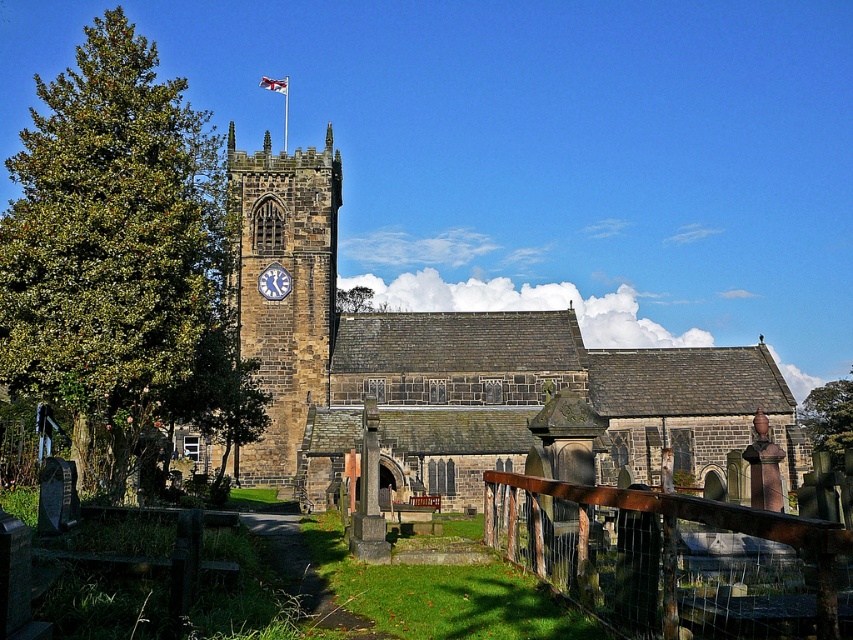
You are a photographer planning to capture the brown stone church at center and the green leafy tree at center in a single wide shot. Based on their widths, which object will occupy more space in the photo?

The brown stone church at center will occupy more space in the photo since its width surpasses that of the green leafy tree at center.

You are standing in front of the historic stone church and want to take a photo that includes both the brown stone church at center and the green leafy tree at center. Which object should you focus on first to ensure both are in frame?

The brown stone church at center is bigger than the green leafy tree at center, so you should focus on the brown stone church at center first to ensure both fit in the frame.